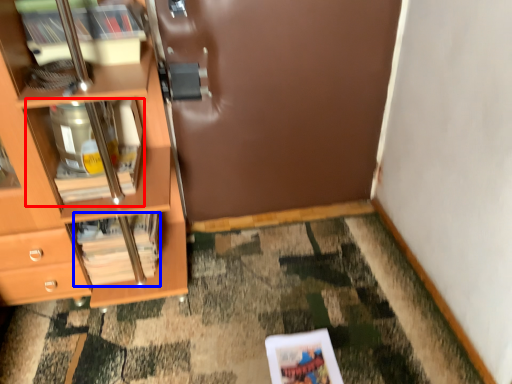
Question: Among these objects, which one is nearest to the camera, cabinet (highlighted by a red box) or magazine (highlighted by a blue box)?

Choices:
 (A) cabinet
 (B) magazine

Answer: (A)